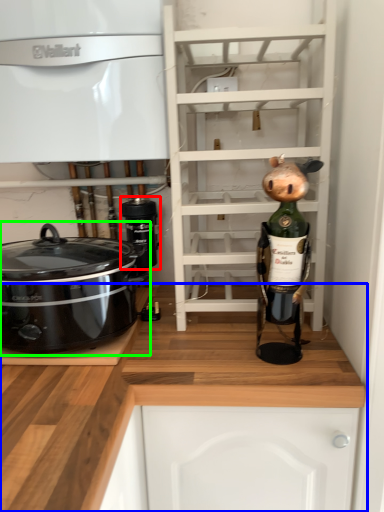
Question: Estimate the real-world distances between objects in this image. Which object is farther from appliance (highlighted by a red box), cabinetry (highlighted by a blue box) or home appliance (highlighted by a green box)?

Choices:
 (A) cabinetry
 (B) home appliance

Answer: (A)